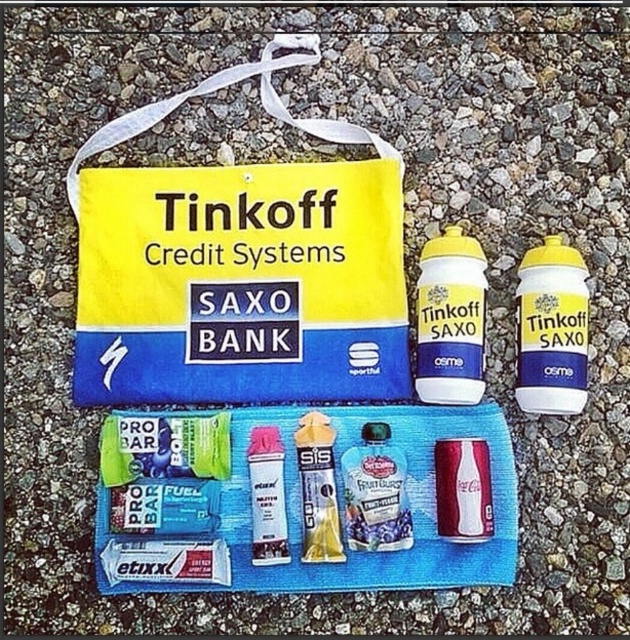
Question: Which point is farther to the camera?

Choices:
 (A) metallic silver can at center
 (B) matte white tube at center

Answer: (B)

Question: Which is farther from the translucent plastic fruit juice at center?

Choices:
 (A) yellow fabric bag at upper center
 (B) metallic silver can at center
 (C) green matte bar at lower left

Answer: (A)

Question: Which of the following is the closest to the observer?

Choices:
 (A) yellow matte bottle at center
 (B) yellow matte gel at center
 (C) yellow matte water bottle at center
 (D) green matte bar at lower left

Answer: (A)

Question: Does metallic silver can at center appear under matte white tube at center?

Choices:
 (A) no
 (B) yes

Answer: (A)

Question: Is the position of yellow matte water bottle at center less distant than that of translucent plastic fruit juice at center?

Choices:
 (A) yes
 (B) no

Answer: (B)

Question: Can you confirm if green matte bar at lower left is positioned above metallic silver can at center?

Choices:
 (A) yes
 (B) no

Answer: (A)